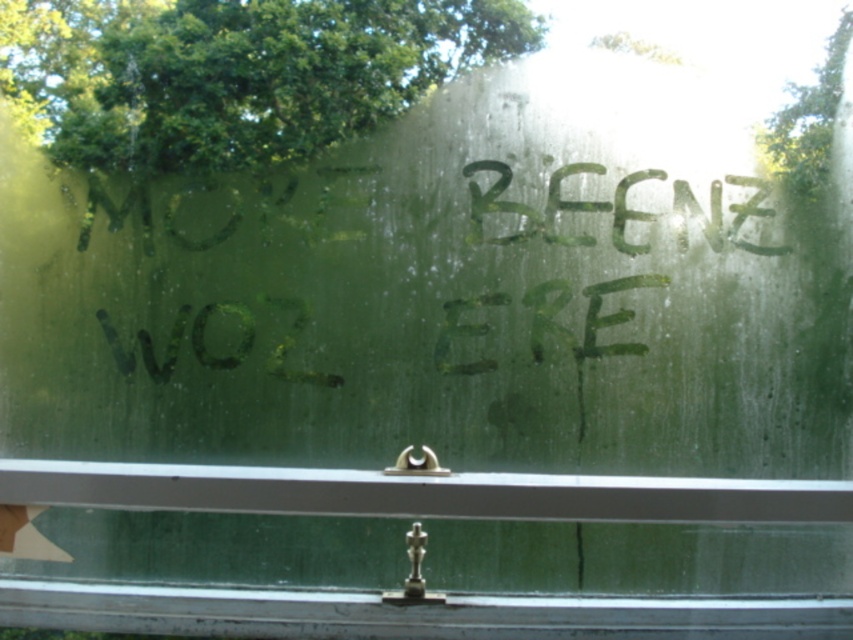
You have a small decorative item that is 10 cm wide. You want to place it on the metallic silver window sill at lower center without overlapping the green paint at center. Is there enough space?

The metallic silver window sill at lower center might be wider than the green paint at center, so there might be enough space to place the 10 cm wide decorative item without overlapping the green paint at center. However, since the exact width difference isn not specified, it is uncertain.

You are a photographer trying to capture the text on the window. You notice two points on the window marked as point 1 at coordinate (619,608) and point 2 at coordinate (508,179). Which point is closer to your camera lens?

Point 1 at coordinate (619,608) is closer to the camera than point 2 at coordinate (508,179).

You are a window cleaner who needs to reach both the metallic silver window sill at lower center and the green paint at center. Which object requires you to stand on a ladder to clean?

The green paint at center requires you to stand on a ladder because it has a greater height than the metallic silver window sill at lower center.